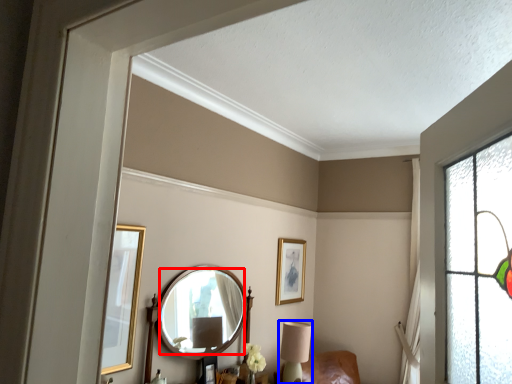
Question: Which object is closer to the camera taking this photo, mirror (highlighted by a red box) or table lamp (highlighted by a blue box)?

Choices:
 (A) mirror
 (B) table lamp

Answer: (A)